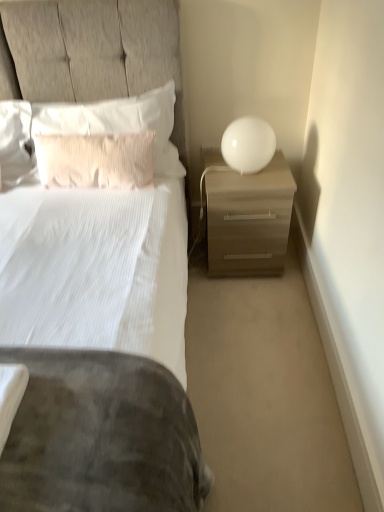
Find the location of `empty space that is ontop of matte wood nightstand at right (from a real-world perspective)`. empty space that is ontop of matte wood nightstand at right (from a real-world perspective) is located at coordinates (248, 176).